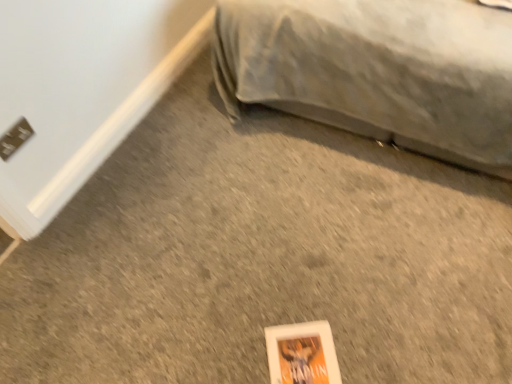
Describe the element at coordinates (377, 71) in the screenshot. The width and height of the screenshot is (512, 384). I see `gray fabric bed at upper right` at that location.

Find the location of a particular element. This screenshot has height=384, width=512. gray fabric bed at upper right is located at coordinates (377, 71).

Describe the element at coordinates (302, 354) in the screenshot. This screenshot has height=384, width=512. I see `white matte paperback book at lower center` at that location.

Looking at this image, measure the distance between metallic gray electric outlet at lower left and camera.

The depth of metallic gray electric outlet at lower left is 1.47 meters.

Locate an element on the screen. The width and height of the screenshot is (512, 384). gray fabric bed at upper right is located at coordinates (377, 71).

In the scene shown: Would you say white matte paperback book at lower center is outside metallic gray electric outlet at lower left?

Yes, white matte paperback book at lower center is outside of metallic gray electric outlet at lower left.

From the image's perspective, who appears lower, white matte paperback book at lower center or metallic gray electric outlet at lower left?

white matte paperback book at lower center is shown below in the image.

Considering the relative sizes of white matte paperback book at lower center and metallic gray electric outlet at lower left in the image provided, is white matte paperback book at lower center thinner than metallic gray electric outlet at lower left?

No, white matte paperback book at lower center is not thinner than metallic gray electric outlet at lower left.

From a real-world perspective, which is physically below, white matte paperback book at lower center or metallic gray electric outlet at lower left?

From a 3D spatial view, white matte paperback book at lower center is below.

How much distance is there between gray fabric bed at upper right and metallic gray electric outlet at lower left?

1.21 meters.

Locate an element on the screen. furniture above the metallic gray electric outlet at lower left (from a real-world perspective) is located at coordinates (377, 71).

Between gray fabric bed at upper right and metallic gray electric outlet at lower left, which one is positioned behind?

metallic gray electric outlet at lower left is behind.

Is gray fabric bed at upper right aimed at metallic gray electric outlet at lower left?

Yes, gray fabric bed at upper right faces towards metallic gray electric outlet at lower left.

Which object is positioned more to the left, white matte paperback book at lower center or gray fabric bed at upper right?

From the viewer's perspective, white matte paperback book at lower center appears more on the left side.

From the image's perspective, is white matte paperback book at lower center under gray fabric bed at upper right?

Correct, white matte paperback book at lower center appears lower than gray fabric bed at upper right in the image.

Considering the relative sizes of white matte paperback book at lower center and gray fabric bed at upper right in the image provided, is white matte paperback book at lower center wider than gray fabric bed at upper right?

No, white matte paperback book at lower center is not wider than gray fabric bed at upper right.

Is metallic gray electric outlet at lower left shorter than white matte paperback book at lower center?

In fact, metallic gray electric outlet at lower left may be taller than white matte paperback book at lower center.

Between metallic gray electric outlet at lower left and white matte paperback book at lower center, which one appears on the right side from the viewer's perspective?

Positioned to the right is white matte paperback book at lower center.

Would you say metallic gray electric outlet at lower left is a long distance from white matte paperback book at lower center?

Yes.

Considering the positions of point (24, 136) and point (281, 367), is point (24, 136) closer or farther from the camera than point (281, 367)?

Point (24, 136) appears to be farther away from the viewer than point (281, 367).

Is point (8, 139) positioned behind point (423, 2)?

No.

Which object is thinner, metallic gray electric outlet at lower left or gray fabric bed at upper right?

With smaller width is metallic gray electric outlet at lower left.

Consider the image. Is metallic gray electric outlet at lower left directly adjacent to gray fabric bed at upper right?

No, metallic gray electric outlet at lower left is not beside gray fabric bed at upper right.

How many degrees apart are the facing directions of metallic gray electric outlet at lower left and gray fabric bed at upper right?

There is a 90-degree angle between the facing directions of metallic gray electric outlet at lower left and gray fabric bed at upper right.

Could you tell me if gray fabric bed at upper right is turned towards white matte paperback book at lower center?

Yes, gray fabric bed at upper right is oriented towards white matte paperback book at lower center.

Is gray fabric bed at upper right next to white matte paperback book at lower center and touching it?

No, gray fabric bed at upper right is not beside white matte paperback book at lower center.

From a real-world perspective, is gray fabric bed at upper right located higher than white matte paperback book at lower center?

Correct, in the physical world, gray fabric bed at upper right is higher than white matte paperback book at lower center.

Which is less distant, (315, 55) or (318, 376)?

Point (315, 55) is farther from the camera than point (318, 376).

Find the location of a particular element. The image size is (512, 384). paperback book located in front of the metallic gray electric outlet at lower left is located at coordinates (302, 354).

This screenshot has width=512, height=384. What are the coordinates of `furniture on the right of metallic gray electric outlet at lower left` in the screenshot? It's located at 377,71.

Looking at the image, which one is located further to metallic gray electric outlet at lower left, gray fabric bed at upper right or white matte paperback book at lower center?

Based on the image, gray fabric bed at upper right appears to be further to metallic gray electric outlet at lower left.

When comparing their distances from gray fabric bed at upper right, does metallic gray electric outlet at lower left or white matte paperback book at lower center seem closer?

Based on the image, white matte paperback book at lower center appears to be nearer to gray fabric bed at upper right.

Which object lies further to the anchor point gray fabric bed at upper right, white matte paperback book at lower center or metallic gray electric outlet at lower left?

metallic gray electric outlet at lower left is further to gray fabric bed at upper right.

Which object lies further to the anchor point metallic gray electric outlet at lower left, white matte paperback book at lower center or gray fabric bed at upper right?

The object further to metallic gray electric outlet at lower left is gray fabric bed at upper right.

From the image, which object appears to be farther from white matte paperback book at lower center, gray fabric bed at upper right or metallic gray electric outlet at lower left?

metallic gray electric outlet at lower left lies further to white matte paperback book at lower center than the other object.

Which object lies further to the anchor point white matte paperback book at lower center, metallic gray electric outlet at lower left or gray fabric bed at upper right?

metallic gray electric outlet at lower left is positioned further to the anchor white matte paperback book at lower center.

Identify the location of paperback book between metallic gray electric outlet at lower left and gray fabric bed at upper right. This screenshot has width=512, height=384. (302, 354).